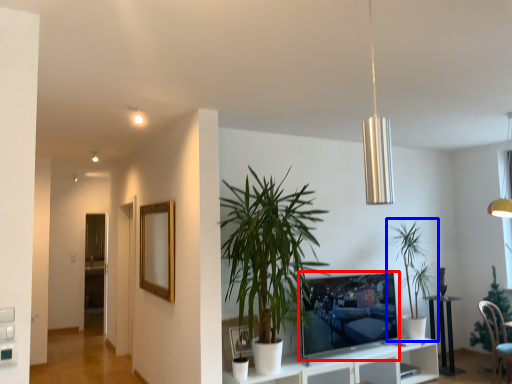
Question: Which point is further to the camera, television (highlighted by a red box) or houseplant (highlighted by a blue box)?

Choices:
 (A) television
 (B) houseplant

Answer: (B)